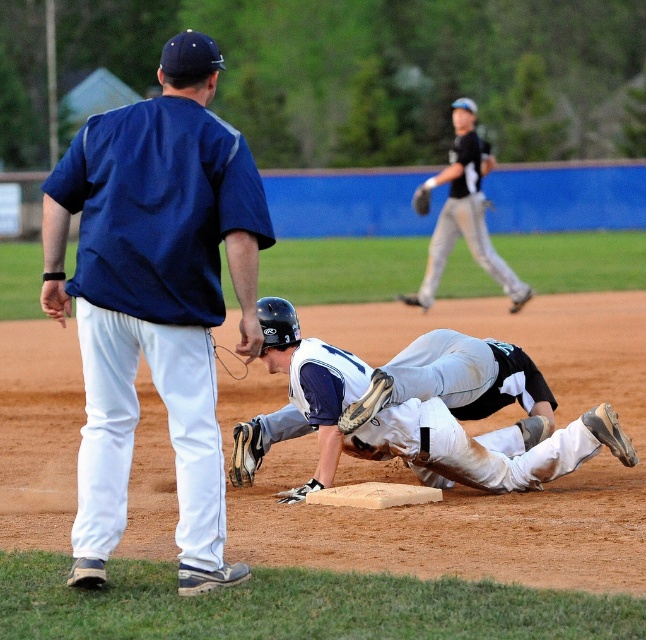
Question: Which is farther from the black jersey at upper right?

Choices:
 (A) white matte uniform at center
 (B) blue fabric shirt at upper left

Answer: (B)

Question: From the image, what is the correct spatial relationship of blue fabric shirt at upper left in relation to white matte uniform at center?

Choices:
 (A) above
 (B) below

Answer: (A)

Question: Which object is farther from the camera taking this photo?

Choices:
 (A) brown leather glove at center
 (B) white matte uniform at center
 (C) black jersey at upper right
 (D) blue fabric shirt at upper left

Answer: (C)

Question: From the image, what is the correct spatial relationship of white matte uniform at center in relation to brown leather glove at center?

Choices:
 (A) left
 (B) right

Answer: (A)

Question: Estimate the real-world distances between objects in this image. Which object is closer to the blue fabric shirt at upper left?

Choices:
 (A) brown leather glove at center
 (B) black jersey at upper right

Answer: (A)

Question: Considering the relative positions of black jersey at upper right and brown leather glove at center in the image provided, where is black jersey at upper right located with respect to brown leather glove at center?

Choices:
 (A) above
 (B) below

Answer: (A)